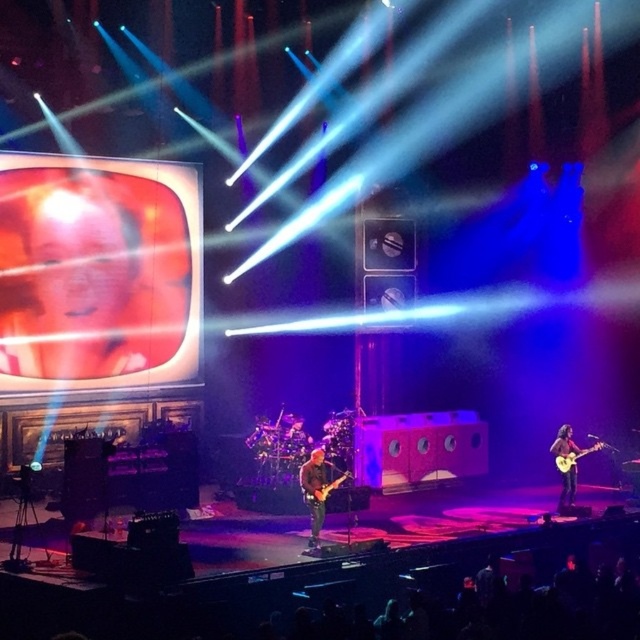
You are a stagehand needing to place a 5 inch wide microphone stand between the shiny brown guitar at right and the light brown wooden guitar at right. Can you fit it there?

The distance between the shiny brown guitar at right and the light brown wooden guitar at right is 4.98 inches. Since the microphone stand is 5 inches wide, it cannot fit in that space.

You are a stagehand holding a microphone stand that is 1.5 meters long. You need to place it between the shiny brown guitar at right and the glossy electric guitar at center. Is there enough space for the microphone stand between them?

The distance between the shiny brown guitar at right and the glossy electric guitar at center is 3.47 meters, which is more than enough space to place the 1.5 meter long microphone stand between them.

You are a stagehand preparing to move the shiny black guitar at center and the light brown wooden guitar at right. Which guitar requires a larger carrying case?

The shiny black guitar at center requires a larger carrying case because it is larger in size than the light brown wooden guitar at right.